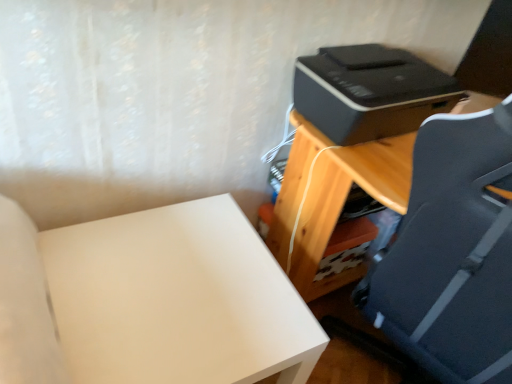
Question: From the image's perspective, is white matte table at lower left on wooden desk at right?

Choices:
 (A) no
 (B) yes

Answer: (A)

Question: Could you tell me if white matte table at lower left is turned towards wooden desk at right?

Choices:
 (A) yes
 (B) no

Answer: (B)

Question: Considering the relative positions of white matte table at lower left and wooden desk at right in the image provided, is white matte table at lower left behind wooden desk at right?

Choices:
 (A) yes
 (B) no

Answer: (A)

Question: Is white matte table at lower left to the left of wooden desk at right from the viewer's perspective?

Choices:
 (A) yes
 (B) no

Answer: (A)

Question: Is white matte table at lower left placed right next to wooden desk at right?

Choices:
 (A) no
 (B) yes

Answer: (A)

Question: Based on their positions, is black plastic printer at upper right located to the left or right of white matte table at lower left?

Choices:
 (A) right
 (B) left

Answer: (A)

Question: Based on their sizes in the image, would you say black plastic printer at upper right is bigger or smaller than white matte table at lower left?

Choices:
 (A) small
 (B) big

Answer: (A)

Question: Considering the positions of black plastic printer at upper right and white matte table at lower left in the image, is black plastic printer at upper right taller or shorter than white matte table at lower left?

Choices:
 (A) tall
 (B) short

Answer: (B)

Question: Is point [368, 104] closer or farther from the camera than point [195, 294]?

Choices:
 (A) closer
 (B) farther

Answer: (B)

Question: Considering their positions, is wooden desk at right located in front of or behind black plastic printer at upper right?

Choices:
 (A) front
 (B) behind

Answer: (A)

Question: From the image's perspective, is wooden desk at right positioned above or below black plastic printer at upper right?

Choices:
 (A) above
 (B) below

Answer: (B)

Question: Does point click(x=291, y=244) appear closer or farther from the camera than point click(x=346, y=81)?

Choices:
 (A) closer
 (B) farther

Answer: (B)

Question: In terms of width, does wooden desk at right look wider or thinner when compared to black plastic printer at upper right?

Choices:
 (A) thin
 (B) wide

Answer: (B)

Question: From the image's perspective, relative to wooden desk at right, is black plastic printer at upper right above or below?

Choices:
 (A) above
 (B) below

Answer: (A)

Question: Do you think black plastic printer at upper right is within wooden desk at right, or outside of it?

Choices:
 (A) inside
 (B) outside

Answer: (B)